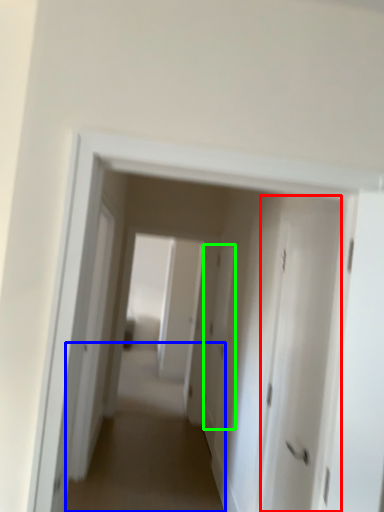
Question: Which object is positioned farthest from door (highlighted by a red box)? Select from alley (highlighted by a blue box) and door (highlighted by a green box).

Choices:
 (A) alley
 (B) door

Answer: (B)